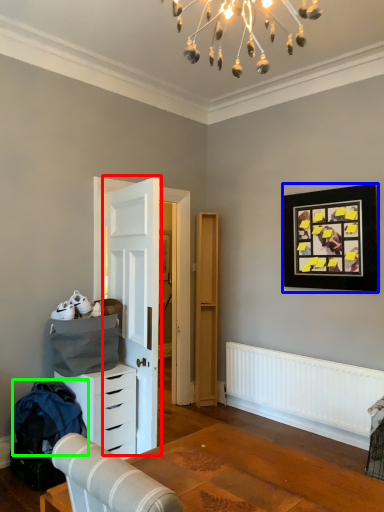
Question: Which object is positioned farthest from door (highlighted by a red box)? Select from picture frame (highlighted by a blue box) and laundry (highlighted by a green box).

Choices:
 (A) picture frame
 (B) laundry

Answer: (A)